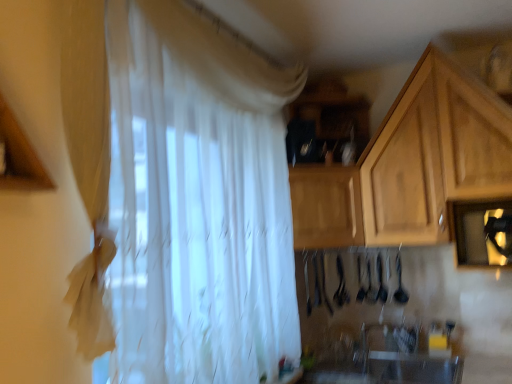
Measure the distance between wooden cabinet at center, the first cabinetry from the left, and camera.

wooden cabinet at center, the first cabinetry from the left, and camera are 2.29 meters apart.

Where is `white glossy sink at lower center`? The image size is (512, 384). white glossy sink at lower center is located at coordinates (386, 344).

This screenshot has height=384, width=512. What do you see at coordinates (196, 204) in the screenshot? I see `white sheer curtain at center` at bounding box center [196, 204].

Find the location of a particular element. Image resolution: width=512 pixels, height=384 pixels. wooden cabinet at center, which is counted as the 2th cabinetry, starting from the right is located at coordinates (326, 206).

Find the location of a particular element. curtain lying in front of the white glossy sink at lower center is located at coordinates (196, 204).

Is point (177, 298) closer or farther from the camera than point (406, 327)?

Clearly, point (177, 298) is closer to the camera than point (406, 327).

From the image's perspective, is white sheer curtain at center above white glossy sink at lower center?

Yes, from the image's perspective, white sheer curtain at center is on top of white glossy sink at lower center.

Is white sheer curtain at center completely or partially outside of white glossy sink at lower center?

Indeed, white sheer curtain at center is completely outside white glossy sink at lower center.

Is the position of white sheer curtain at center more distant than that of wooden cabinet at upper right, which ranks as the first cabinetry in right-to-left order?

No, white sheer curtain at center is closer to the camera.

From the image's perspective, which is above, white sheer curtain at center or wooden cabinet at upper right, which ranks as the first cabinetry in right-to-left order?

wooden cabinet at upper right, which ranks as the first cabinetry in right-to-left order, is shown above in the image.

Based on the photo, from a real-world perspective, between white sheer curtain at center and wooden cabinet at upper right, which is counted as the 2th cabinetry, starting from the left, who is vertically lower?

white sheer curtain at center, from a real-world perspective.

Considering the points (222, 187) and (469, 172), which point is behind, point (222, 187) or point (469, 172)?

The point (469, 172) is more distant.

Can you see white glossy sink at lower center touching white sheer curtain at center?

No, white glossy sink at lower center is not making contact with white sheer curtain at center.

Which of these two, white glossy sink at lower center or white sheer curtain at center, is smaller?

white glossy sink at lower center.

Considering the positions of objects white glossy sink at lower center and white sheer curtain at center in the image provided, who is more to the left, white glossy sink at lower center or white sheer curtain at center?

Positioned to the left is white sheer curtain at center.

Looking at this image, which object is wider, white glossy sink at lower center or white sheer curtain at center?

white sheer curtain at center.

Is wooden cabinet at upper right, which ranks as the first cabinetry in right-to-left order, placed right next to wooden cabinet at center, the first cabinetry from the left?

wooden cabinet at upper right, which ranks as the first cabinetry in right-to-left order, is not next to wooden cabinet at center, the first cabinetry from the left, and they're not touching.

How different are the orientations of wooden cabinet at upper right, which is counted as the 2th cabinetry, starting from the left, and wooden cabinet at center, which is counted as the 2th cabinetry, starting from the right, in degrees?

The angular difference between wooden cabinet at upper right, which is counted as the 2th cabinetry, starting from the left, and wooden cabinet at center, which is counted as the 2th cabinetry, starting from the right, is 19.4 degrees.

From a real-world perspective, is wooden cabinet at upper right, which ranks as the first cabinetry in right-to-left order, above or below wooden cabinet at center, the first cabinetry from the left?

wooden cabinet at upper right, which ranks as the first cabinetry in right-to-left order, is above wooden cabinet at center, the first cabinetry from the left.

Is wooden cabinet at upper right, which ranks as the first cabinetry in right-to-left order, further to camera compared to wooden cabinet at center, the first cabinetry from the left?

That is False.

Is wooden cabinet at center, which is counted as the 2th cabinetry, starting from the right, positioned before wooden cabinet at upper right, which is counted as the 2th cabinetry, starting from the left?

No, it is not.

In the scene shown: Would you say wooden cabinet at center, which is counted as the 2th cabinetry, starting from the right, is inside or outside wooden cabinet at upper right, which ranks as the first cabinetry in right-to-left order?

The correct answer is: inside.

Does point (350, 224) come in front of point (446, 179)?

No, (350, 224) is further to viewer.

From the image's perspective, is wooden cabinet at center, the first cabinetry from the left, located above or below wooden cabinet at upper right, which ranks as the first cabinetry in right-to-left order?

wooden cabinet at center, the first cabinetry from the left, is below wooden cabinet at upper right, which ranks as the first cabinetry in right-to-left order.

Considering the points (392, 217) and (277, 262), which point is behind, point (392, 217) or point (277, 262)?

The point (392, 217) is more distant.

Based on their sizes in the image, would you say wooden cabinet at upper right, which is counted as the 2th cabinetry, starting from the left, is bigger or smaller than white sheer curtain at center?

Considering their sizes, wooden cabinet at upper right, which is counted as the 2th cabinetry, starting from the left, takes up more space than white sheer curtain at center.

Based on the photo, is wooden cabinet at upper right, which is counted as the 2th cabinetry, starting from the left, inside the boundaries of white sheer curtain at center, or outside?

wooden cabinet at upper right, which is counted as the 2th cabinetry, starting from the left, is spatially situated outside white sheer curtain at center.

Which of these two, wooden cabinet at center, which is counted as the 2th cabinetry, starting from the right, or white sheer curtain at center, is smaller?

Smaller between the two is wooden cabinet at center, which is counted as the 2th cabinetry, starting from the right.

From a real-world perspective, is wooden cabinet at center, which is counted as the 2th cabinetry, starting from the right, on top of white sheer curtain at center?

No, from a real-world perspective, wooden cabinet at center, which is counted as the 2th cabinetry, starting from the right, is not above white sheer curtain at center.

In the image, there is a white sheer curtain at center. Where is `cabinetry below it (from the image's perspective)`? This screenshot has height=384, width=512. cabinetry below it (from the image's perspective) is located at coordinates (326, 206).

Can you confirm if wooden cabinet at center, the first cabinetry from the left, is wider than white sheer curtain at center?

Yes, wooden cabinet at center, the first cabinetry from the left, is wider than white sheer curtain at center.

Locate an element on the screen. This screenshot has height=384, width=512. sink below the white sheer curtain at center (from the image's perspective) is located at coordinates (386, 344).

Locate an element on the screen. This screenshot has height=384, width=512. cabinetry located above the white sheer curtain at center (from a real-world perspective) is located at coordinates (411, 165).

When comparing their distances from wooden cabinet at upper right, which ranks as the first cabinetry in right-to-left order, does wooden cabinet at center, which is counted as the 2th cabinetry, starting from the right, or white sheer curtain at center seem further?

white sheer curtain at center is further to wooden cabinet at upper right, which ranks as the first cabinetry in right-to-left order.

When comparing their distances from wooden cabinet at upper right, which ranks as the first cabinetry in right-to-left order, does wooden cabinet at center, which is counted as the 2th cabinetry, starting from the right, or white glossy sink at lower center seem closer?

wooden cabinet at center, which is counted as the 2th cabinetry, starting from the right.

Which object lies further to the anchor point white glossy sink at lower center, wooden cabinet at upper right, which ranks as the first cabinetry in right-to-left order, or wooden cabinet at center, the first cabinetry from the left?

wooden cabinet at upper right, which ranks as the first cabinetry in right-to-left order.

Estimate the real-world distances between objects in this image. Which object is closer to wooden cabinet at center, the first cabinetry from the left, white glossy sink at lower center or wooden cabinet at upper right, which is counted as the 2th cabinetry, starting from the left?

wooden cabinet at upper right, which is counted as the 2th cabinetry, starting from the left, is positioned closer to the anchor wooden cabinet at center, the first cabinetry from the left.

Considering their positions, is white glossy sink at lower center positioned further to white sheer curtain at center than wooden cabinet at upper right, which is counted as the 2th cabinetry, starting from the left?

white glossy sink at lower center is positioned further to the anchor white sheer curtain at center.

Based on the photo, which object lies further to the anchor point white sheer curtain at center, wooden cabinet at upper right, which ranks as the first cabinetry in right-to-left order, or wooden cabinet at center, the first cabinetry from the left?

wooden cabinet at upper right, which ranks as the first cabinetry in right-to-left order, is positioned further to the anchor white sheer curtain at center.

When comparing their distances from wooden cabinet at upper right, which is counted as the 2th cabinetry, starting from the left, does white sheer curtain at center or white glossy sink at lower center seem further?

Among the two, white glossy sink at lower center is located further to wooden cabinet at upper right, which is counted as the 2th cabinetry, starting from the left.

Which object lies further to the anchor point wooden cabinet at center, the first cabinetry from the left, white glossy sink at lower center or white sheer curtain at center?

white glossy sink at lower center.

Where is `cabinetry between wooden cabinet at upper right, which is counted as the 2th cabinetry, starting from the left, and white glossy sink at lower center, in the vertical direction`? cabinetry between wooden cabinet at upper right, which is counted as the 2th cabinetry, starting from the left, and white glossy sink at lower center, in the vertical direction is located at coordinates (326, 206).

I want to click on cabinetry between white sheer curtain at center and wooden cabinet at center, which is counted as the 2th cabinetry, starting from the right, in the front-back direction, so click(x=411, y=165).